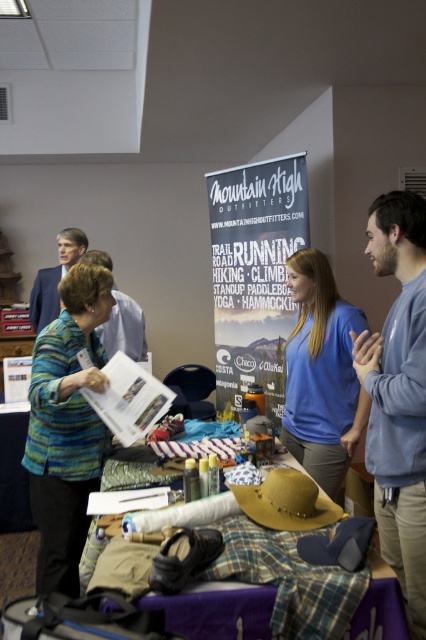
Question: Can you confirm if gray fleece sweatshirt at right is wider than striped wool sweater at center?

Choices:
 (A) no
 (B) yes

Answer: (A)

Question: Which object is farther from the camera taking this photo?

Choices:
 (A) plaid fabric at center
 (B) striped wool sweater at center
 (C) blue cotton shirt at center
 (D) gray fleece sweatshirt at right

Answer: (C)

Question: Is striped wool sweater at center thinner than plaid fabric at center?

Choices:
 (A) yes
 (B) no

Answer: (A)

Question: Considering the real-world distances, which object is closest to the gray fleece sweatshirt at right?

Choices:
 (A) striped wool sweater at center
 (B) blue textured blazer at upper left
 (C) blue cotton shirt at center

Answer: (C)

Question: Among these points, which one is farthest from the camera?

Choices:
 (A) (34, 484)
 (B) (308, 321)
 (C) (34, 308)

Answer: (C)

Question: In this image, where is gray fleece sweatshirt at right located relative to blue textured blazer at upper left?

Choices:
 (A) left
 (B) right

Answer: (B)